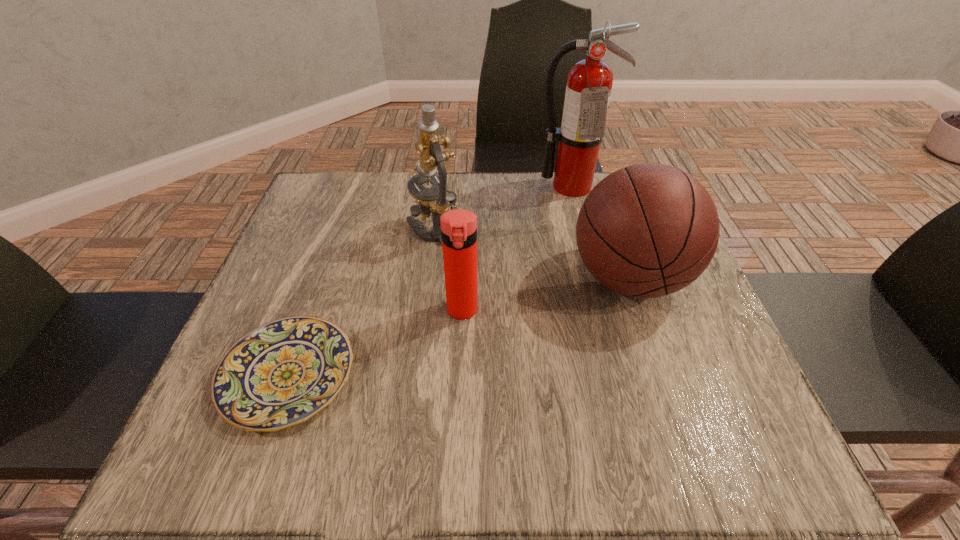
At what (x,y) coordinates should I click in order to perform the action: click on fire extinguisher. Please return your answer as a coordinate pair (x, y). Looking at the image, I should click on (589, 82).

Locate an element on the screen. the farthest object is located at coordinates (589, 82).

At what (x,y) coordinates should I click in order to perform the action: click on microscope. Please return your answer as a coordinate pair (x, y). Looking at the image, I should click on (436, 200).

In order to click on basketball in this screenshot , I will do `click(648, 230)`.

Image resolution: width=960 pixels, height=540 pixels. Identify the location of thermos bottle. (458, 227).

Locate an element on the screen. This screenshot has width=960, height=540. plate is located at coordinates (282, 373).

Where is `the shortest object`? the shortest object is located at coordinates (282, 373).

This screenshot has height=540, width=960. I want to click on free space located on the nozzle side of the fire extinguisher, so click(x=593, y=274).

What are the coordinates of `vacant space located on the right of the microscope` in the screenshot? It's located at (596, 228).

What are the coordinates of `free space located 0.140m on the left of the basketball` in the screenshot? It's located at (502, 279).